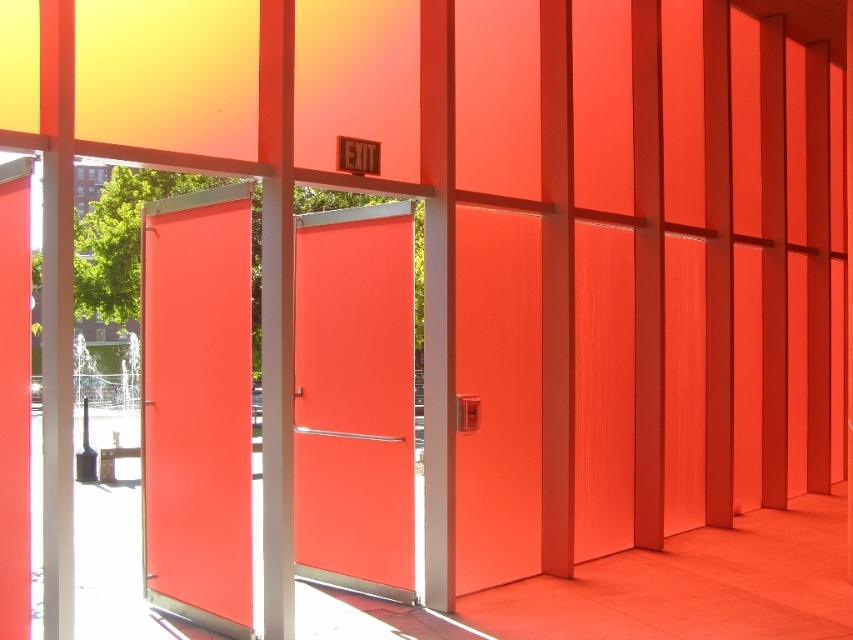
Can you confirm if matte orange doors at center is positioned to the right of matte orange door at center?

No, matte orange doors at center is not to the right of matte orange door at center.

Who is taller, matte orange doors at center or matte orange door at center?

matte orange doors at center

Does point (235, 625) come closer to viewer compared to point (343, 484)?

Yes.

You are a GUI agent. You are given a task and a screenshot of the screen. Output one action in this format:
    pyautogui.click(x=<x>, y=<y>)
    Task: Click on the matte orange doors at center
    The height and width of the screenshot is (640, 853).
    Given the screenshot: What is the action you would take?
    pyautogui.click(x=196, y=406)

Which is in front, point (155, 534) or point (219, 429)?

Point (219, 429) is in front.

Identify the location of matte orange doors at center. click(196, 406).

Which is behind, point (155, 387) or point (241, 440)?

Point (155, 387)

You are a GUI agent. You are given a task and a screenshot of the screen. Output one action in this format:
    pyautogui.click(x=<x>, y=<y>)
    Task: Click on the matte orange doors at center
    Image resolution: width=853 pixels, height=640 pixels.
    Given the screenshot: What is the action you would take?
    pyautogui.click(x=196, y=406)

Which of these two, satin glass door at left or matte orange door at center, stands shorter?

Standing shorter between the two is matte orange door at center.

Is satin glass door at left in front of matte orange door at center?

Yes.

Describe the element at coordinates (196, 406) in the screenshot. This screenshot has width=853, height=640. I see `satin glass door at left` at that location.

Locate an element on the screen. Image resolution: width=853 pixels, height=640 pixels. satin glass door at left is located at coordinates (196, 406).